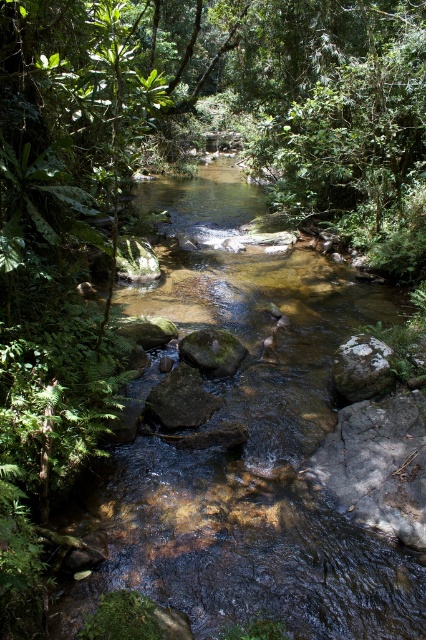
Question: Is the position of smooth brown rock at center less distant than that of smooth gray rock at center?

Choices:
 (A) yes
 (B) no

Answer: (B)

Question: Estimate the real-world distances between objects in this image. Which object is closer to the green mossy rock at center?

Choices:
 (A) clear water stream at center
 (B) smooth gray rock at center
 (C) smooth brown rock at center

Answer: (C)

Question: Is clear water stream at center thinner than smooth gray rock at center?

Choices:
 (A) yes
 (B) no

Answer: (B)

Question: Which is farther from the smooth gray rock at center?

Choices:
 (A) smooth brown rock at center
 (B) green mossy rock at center

Answer: (A)

Question: Does smooth gray rock at center appear on the right side of green mossy rock at center?

Choices:
 (A) no
 (B) yes

Answer: (B)

Question: Considering the real-world distances, which object is closest to the clear water stream at center?

Choices:
 (A) smooth gray rock at center
 (B) green mossy rock at center
 (C) smooth brown rock at center

Answer: (B)